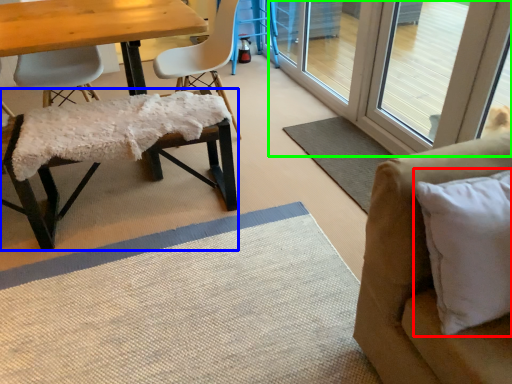
Question: Which is farther away from pillow (highlighted by a red box)? chair (highlighted by a blue box) or screen door (highlighted by a green box)?

Choices:
 (A) chair
 (B) screen door

Answer: (B)